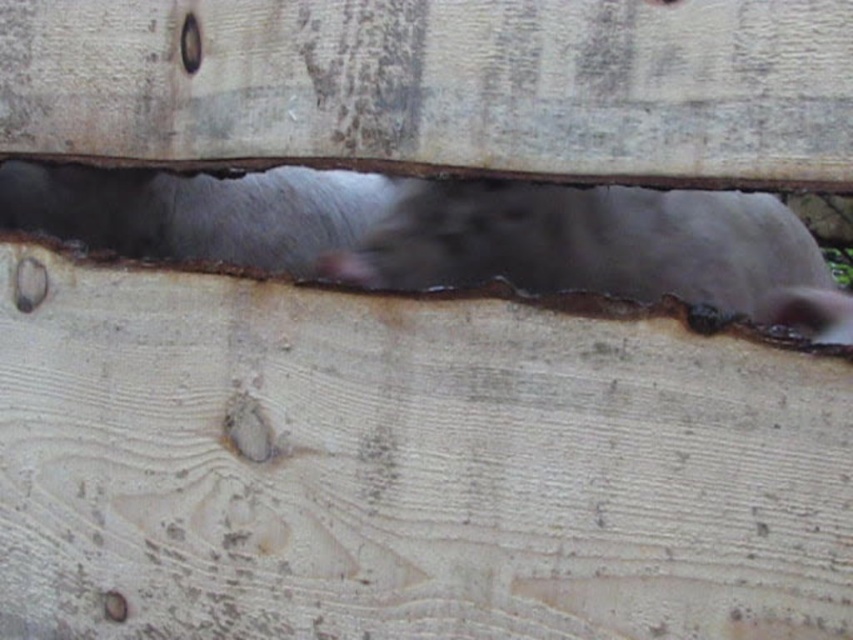
From the picture: Is smooth wood plank at center further to camera compared to gray matte animal at center?

That is False.

I want to click on smooth wood plank at center, so click(442, 86).

What are the coordinates of `smooth wood plank at center` in the screenshot? It's located at (442, 86).

Consider the image. Does smooth wood plank at center appear under brushed metal hole at upper center?

Indeed, smooth wood plank at center is positioned under brushed metal hole at upper center.

Is point (114, 72) farther from camera compared to point (192, 17)?

Yes, it is.

Is point (712, 109) behind point (187, 29)?

No, it is in front of (187, 29).

In order to click on smooth wood plank at center in this screenshot , I will do `click(442, 86)`.

Between point (128, 170) and point (200, 58), which one is positioned in front?

Point (200, 58) is in front.

Between gray matte animal at center and brushed metal hole at upper center, which one has less height?

brushed metal hole at upper center is shorter.

Looking at this image, who is more distant from viewer, [723,273] or [184,64]?

Point [723,273]

You are a GUI agent. You are given a task and a screenshot of the screen. Output one action in this format:
    pyautogui.click(x=<x>, y=<y>)
    Task: Click on the gray matte animal at center
    
    Given the screenshot: What is the action you would take?
    pyautogui.click(x=614, y=248)